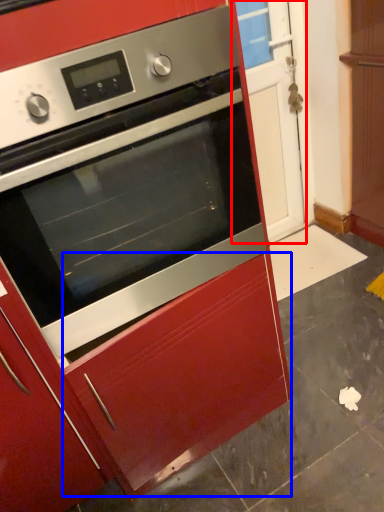
Question: Which of the following is the closest to the observer, glass door (highlighted by a red box) or drawer (highlighted by a blue box)?

Choices:
 (A) glass door
 (B) drawer

Answer: (B)